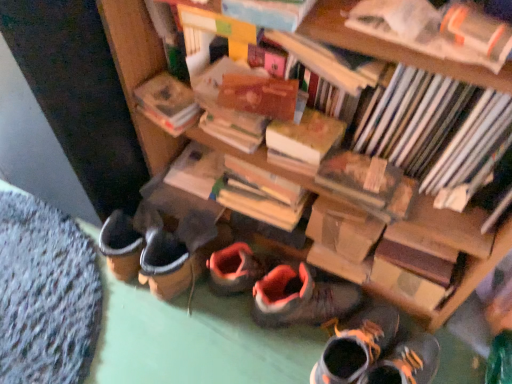
Question: In the image, is hardcover book at upper right, which appears as the fifth book when viewed from the back, positioned in front of or behind hardcover book at center, which is the second book from back to front?

Choices:
 (A) front
 (B) behind

Answer: (A)

Question: Is hardcover book at upper right, which appears as the fifth book when viewed from the back, wider or thinner than hardcover book at center, which is counted as the 4th book, starting from the front?

Choices:
 (A) thin
 (B) wide

Answer: (A)

Question: Estimate the real-world distances between objects in this image. Which object is farther from the orange suede sneaker at center, acting as the second footwear starting from the right?

Choices:
 (A) hardcover book at center, which is counted as the 1th book, starting from the back
 (B) hardcover book at upper center, positioned as the second book in front-to-back order
 (C) wooden bookcase at center
 (D) hardcover book at upper right, the 1th book viewed from the front
 (E) hardcover book at center, the 1th paperback book when ordered from right to left

Answer: (D)

Question: Estimate the real-world distances between objects in this image. Which object is farther from the orange suede sneaker at center, positioned as the first footwear in left-to-right order?

Choices:
 (A) wooden bookcase at center
 (B) hardcover book at upper left, which is the first paperback book in left-to-right order
 (C) hardcover book at center, which is the second book from back to front
 (D) hardcover book at upper center, positioned as the second book in front-to-back order
 (E) hardcover book at upper right, which appears as the fifth book when viewed from the back

Answer: (E)